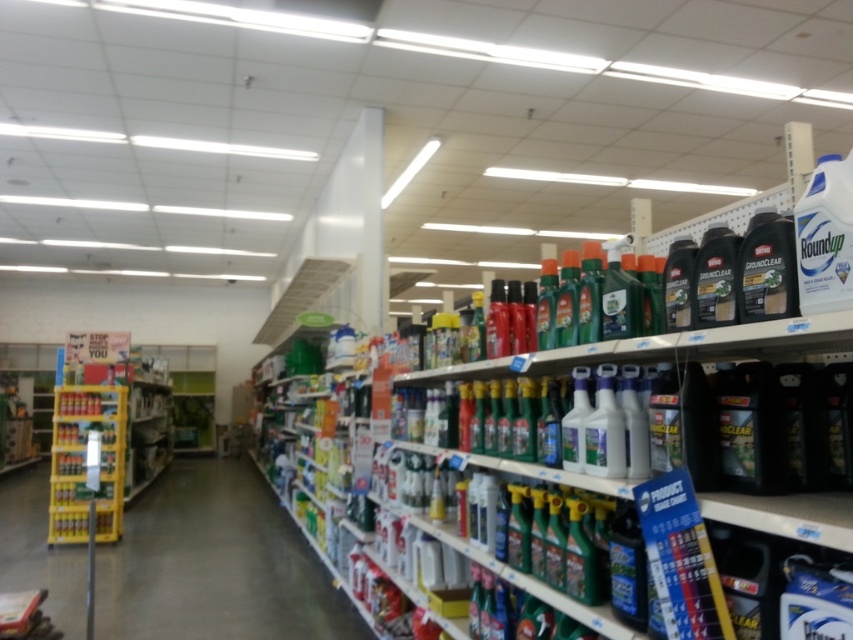
Does green plastic bottles at center have a smaller size compared to yellow plastic shelf at left?

No, green plastic bottles at center is not smaller than yellow plastic shelf at left.

Locate an element on the screen. green plastic bottles at center is located at coordinates pyautogui.click(x=215, y=564).

Locate an element on the screen. This screenshot has width=853, height=640. green plastic bottles at center is located at coordinates (215, 564).